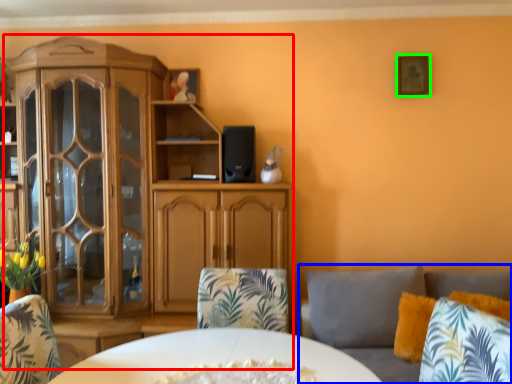
Question: Which is farther away from cabinetry (highlighted by a red box)? studio couch (highlighted by a blue box) or picture frame (highlighted by a green box)?

Choices:
 (A) studio couch
 (B) picture frame

Answer: (B)